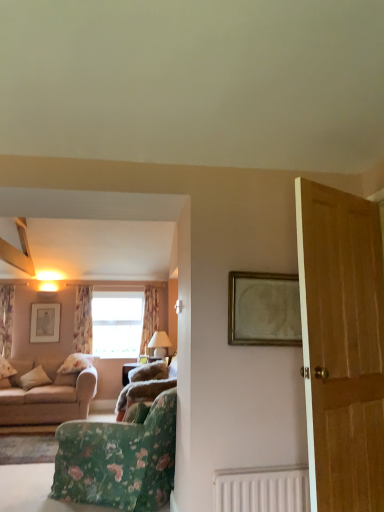
Question: Would you consider beige fabric couch at left, which is the 1th studio couch in left-to-right order, to be distant from gold-toned wooden frame at upper center, arranged as the 1th picture frame when viewed from the front?

Choices:
 (A) no
 (B) yes

Answer: (B)

Question: Does beige fabric couch at left, marked as the second studio couch in a right-to-left arrangement, have a lesser width compared to gold-toned wooden frame at upper center, marked as the 2th picture frame in a bottom-to-top arrangement?

Choices:
 (A) no
 (B) yes

Answer: (A)

Question: Is beige fabric couch at left, marked as the second studio couch in a right-to-left arrangement, behind gold-toned wooden frame at upper center, the first picture frame in the right-to-left sequence?

Choices:
 (A) yes
 (B) no

Answer: (A)

Question: Can you confirm if beige fabric couch at left, marked as the second studio couch in a right-to-left arrangement, is positioned to the left of gold-toned wooden frame at upper center, arranged as the 1th picture frame when viewed from the front?

Choices:
 (A) yes
 (B) no

Answer: (A)

Question: Is beige fabric couch at left, marked as the second studio couch in a right-to-left arrangement, oriented away from gold-toned wooden frame at upper center, marked as the 2th picture frame in a bottom-to-top arrangement?

Choices:
 (A) yes
 (B) no

Answer: (B)

Question: From a real-world perspective, is beige fabric couch at left, marked as the second studio couch in a right-to-left arrangement, located higher than gold-toned wooden frame at upper center, which is counted as the 1th picture frame, starting from the top?

Choices:
 (A) no
 (B) yes

Answer: (A)

Question: Does gold-toned wooden frame at upper center, which is counted as the 1th picture frame, starting from the top, have a larger size compared to white matte radiator at lower center?

Choices:
 (A) no
 (B) yes

Answer: (A)

Question: Is gold-toned wooden frame at upper center, the first picture frame in the right-to-left sequence, beside white matte radiator at lower center?

Choices:
 (A) yes
 (B) no

Answer: (B)

Question: Does gold-toned wooden frame at upper center, the 2th picture frame viewed from the back, turn towards white matte radiator at lower center?

Choices:
 (A) yes
 (B) no

Answer: (B)

Question: Is gold-toned wooden frame at upper center, the first picture frame in the right-to-left sequence, at the right side of white matte radiator at lower center?

Choices:
 (A) no
 (B) yes

Answer: (B)

Question: From the image's perspective, does gold-toned wooden frame at upper center, the first picture frame in the right-to-left sequence, appear lower than white matte radiator at lower center?

Choices:
 (A) yes
 (B) no

Answer: (B)

Question: Is gold-toned wooden frame at upper center, which is counted as the 1th picture frame, starting from the top, at the left side of white matte radiator at lower center?

Choices:
 (A) yes
 (B) no

Answer: (B)

Question: Is matte silver picture frame at upper left, acting as the first picture frame starting from the bottom, taller than white matte radiator at lower center?

Choices:
 (A) yes
 (B) no

Answer: (A)